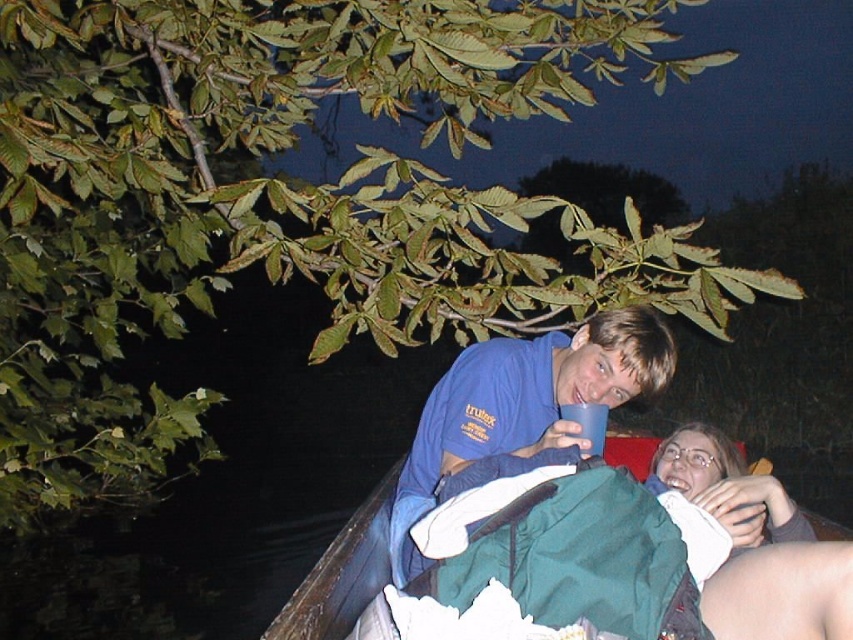
You are trying to place a small decorative item on the blue plastic cup at upper center without it falling off. Considering the green fabric jacket at lower right, where is the safest spot to place it?

The safest spot to place the small decorative item on the blue plastic cup at upper center is away from the edge closest to the green fabric jacket at lower right, as the jacket is positioned directly underneath the cup, which might cause the item to shift or fall if placed near that area.

You are a photographer trying to capture a candid shot of the two people in the scene. You need to ensure that both the blue cotton shirt at upper center and the blue plastic cup at upper center are in focus. Given that your camera can only focus on objects within a 30 cm range, will both items be in focus?

The distance between the blue cotton shirt at upper center and the blue plastic cup at upper center is 28.85 centimeters. Since this is within the 30 cm focus range of the camera, both items will be in focus.

Looking at this image, you are designing a storage box for items found in the image. The box must accommodate both the blue cotton shirt at upper center and the blue plastic cup at upper center. Which item requires more space in the storage box?

The blue cotton shirt at upper center requires more space in the storage box because it is bigger than the blue plastic cup at upper center.